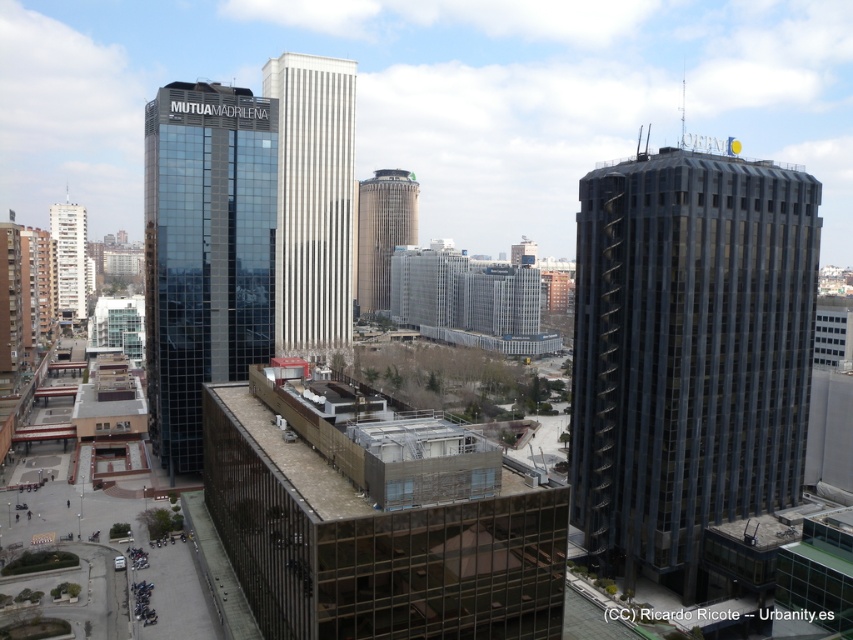
Question: Which object is positioned closest to the matte glass building at center-left?

Choices:
 (A) white textured building at center
 (B) white concrete building at left
 (C) smooth beige tower at center
 (D) dark gray glass building at center

Answer: (A)

Question: Can you confirm if dark gray glass building at center is positioned above matte glass building at center-left?

Choices:
 (A) yes
 (B) no

Answer: (B)

Question: Which of the following is the closest to the observer?

Choices:
 (A) matte glass building at center-left
 (B) white concrete building at left
 (C) smooth beige tower at center

Answer: (A)

Question: Observing the image, what is the correct spatial positioning of matte glass building at center-left in reference to smooth beige tower at center?

Choices:
 (A) above
 (B) below

Answer: (B)

Question: Which of the following is the farthest from the observer?

Choices:
 (A) (167, 305)
 (B) (360, 214)

Answer: (B)

Question: Is white textured building at center bigger than white concrete building at left?

Choices:
 (A) yes
 (B) no

Answer: (B)